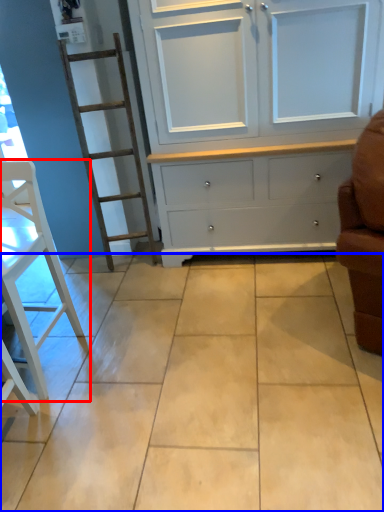
Question: Among these objects, which one is farthest to the camera, furniture (highlighted by a red box) or ceramic tile (highlighted by a blue box)?

Choices:
 (A) furniture
 (B) ceramic tile

Answer: (A)